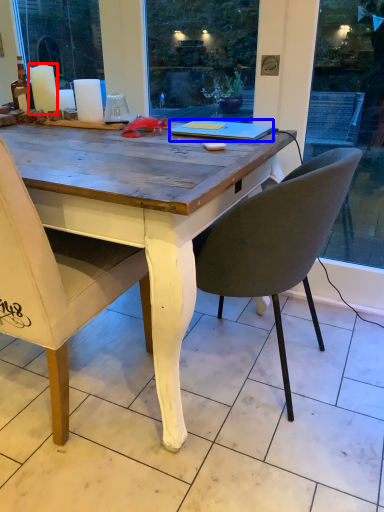
Question: Among these objects, which one is nearest to the camera, candle (highlighted by a red box) or laptop (highlighted by a blue box)?

Choices:
 (A) candle
 (B) laptop

Answer: (B)